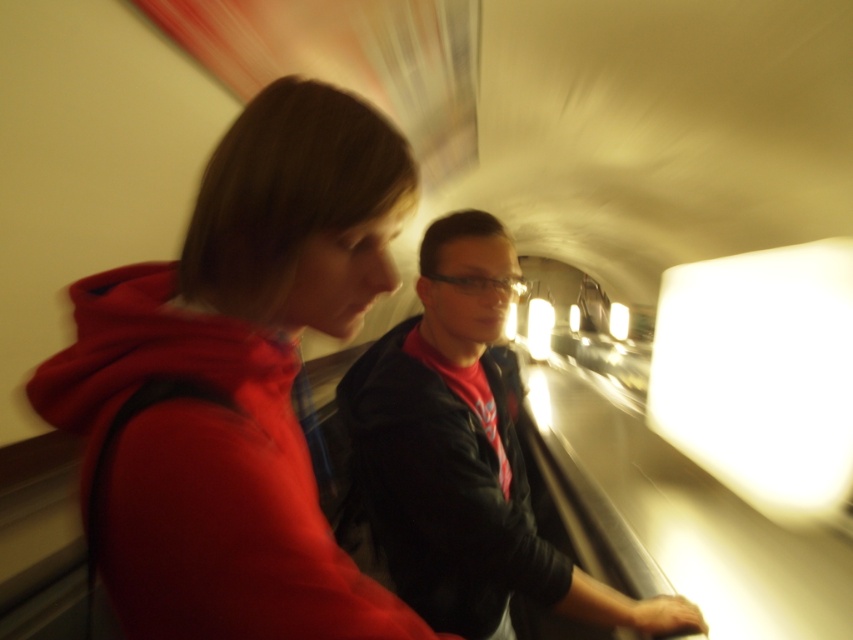
You are standing at the entrance of the moving walkway and see the matte red hoodie at left and the matte black jacket at center. Which person is closer to you?

The matte red hoodie at left is closer to you because it is in front of the matte black jacket at center.

You are standing at the entrance of a moving walkway and see the matte red hoodie at left and the matte black jacket at center. Which object is shorter?

The matte red hoodie at left is shorter than the matte black jacket at center.